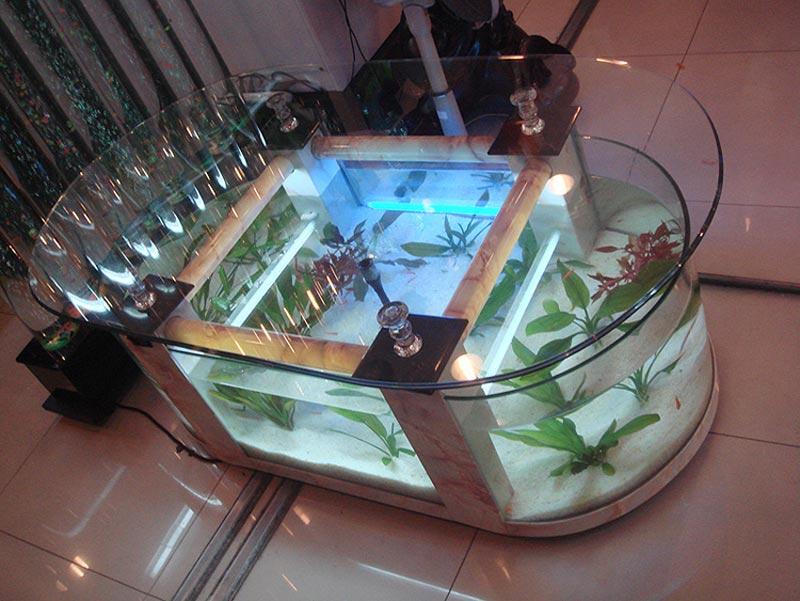
At what (x,y) coordinates should I click in order to perform the action: click on green plants. Please return your answer as a coordinate pair (x, y). The width and height of the screenshot is (800, 601). Looking at the image, I should click on (584, 441), (592, 328).